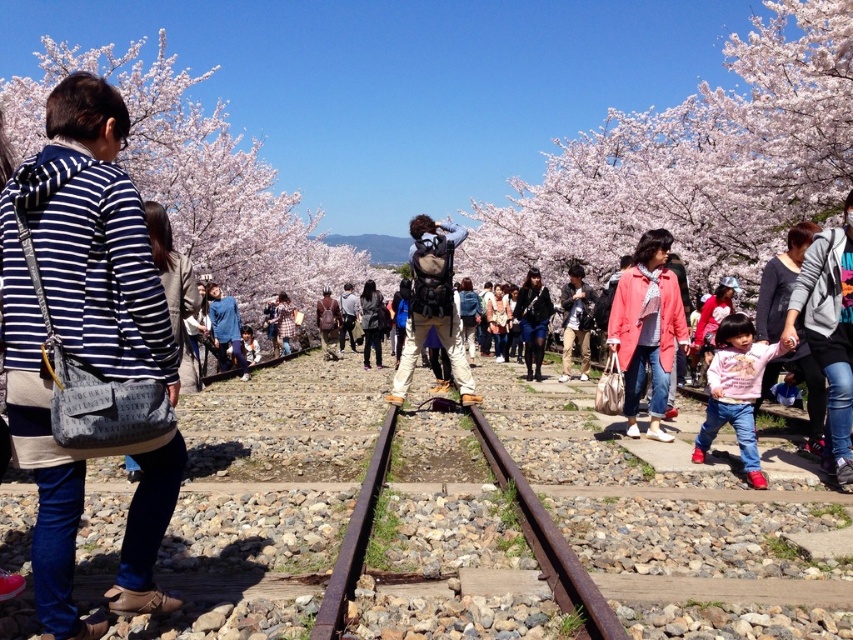
Question: Which point is farther to the camera?

Choices:
 (A) coral matte coat at center
 (B) pink blossoms at upper left

Answer: (B)

Question: Which of these objects is positioned closest to the plaid fabric shirt at center?

Choices:
 (A) denim jacket at lower right
 (B) pink blossoms at upper left
 (C) coral matte coat at center

Answer: (C)

Question: Can you confirm if khaki canvas backpack at center is smaller than matte black backpack at center?

Choices:
 (A) yes
 (B) no

Answer: (A)

Question: Among these objects, which one is farthest from the camera?

Choices:
 (A) matte black backpack at center
 (B) rusty metal train track at center
 (C) brown leather backpack at center
 (D) striped cotton hoodie at left

Answer: (C)

Question: Is rusty metal train track at center smaller than matte black backpack at center?

Choices:
 (A) yes
 (B) no

Answer: (A)

Question: Considering the relative positions of pink fleece jacket at lower right and black leather jacket at center in the image provided, where is pink fleece jacket at lower right located with respect to black leather jacket at center?

Choices:
 (A) above
 (B) below

Answer: (B)